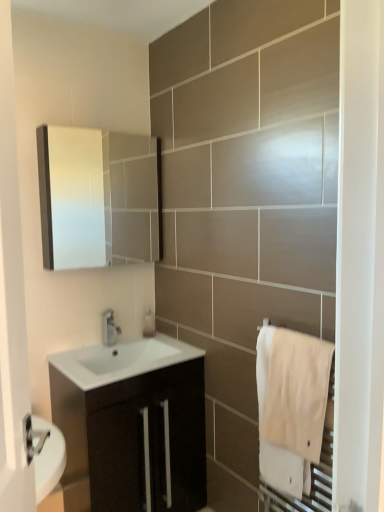
Question: Considering the relative positions of white cotton towel at right and clear plastic soap dispenser at center in the image provided, is white cotton towel at right to the left or to the right of clear plastic soap dispenser at center?

Choices:
 (A) right
 (B) left

Answer: (A)

Question: Is white cotton towel at right in front of or behind clear plastic soap dispenser at center in the image?

Choices:
 (A) front
 (B) behind

Answer: (A)

Question: Considering the real-world distances, which object is farthest from the satin nickel faucet at center?

Choices:
 (A) clear plastic soap dispenser at center
 (B) white cotton towel at right
 (C) matte white medicine cabinet at upper left
 (D) matte black cabinet at center
 (E) white glossy sink at center

Answer: (C)

Question: Which of these objects is positioned closest to the white glossy sink at center?

Choices:
 (A) clear plastic soap dispenser at center
 (B) satin nickel faucet at center
 (C) white cotton towel at right
 (D) matte black cabinet at center
 (E) matte white medicine cabinet at upper left

Answer: (B)